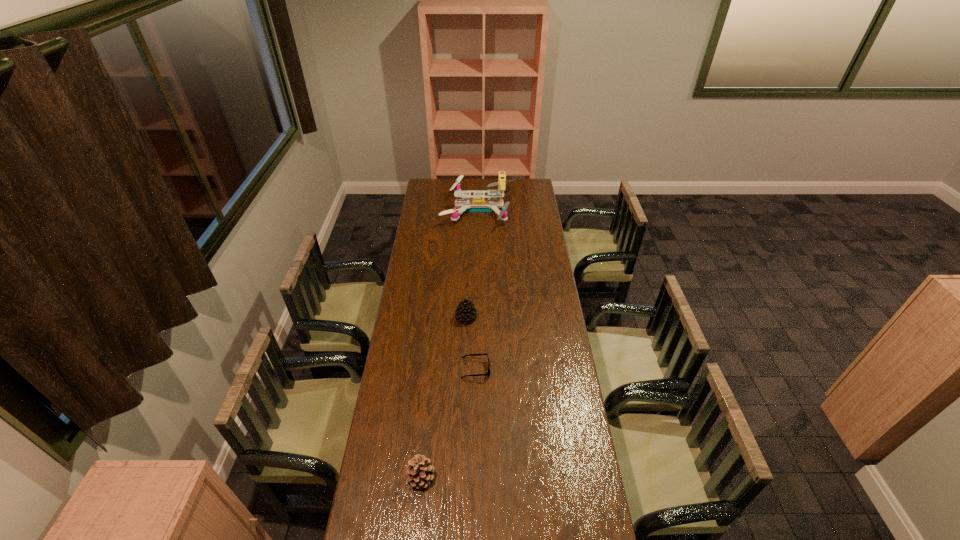
What are the coordinates of `vacant region at the right edge of the desktop` in the screenshot? It's located at (535, 220).

This screenshot has height=540, width=960. Find the location of `free space between the drone and the farther pinecone`. free space between the drone and the farther pinecone is located at coordinates (472, 263).

Find the location of a particular element. The image size is (960, 540). free space between the farthest object and the second nearest object is located at coordinates (477, 289).

At what (x,y) coordinates should I click in order to perform the action: click on free point between the second farthest object and the nearest object. Please return your answer as a coordinate pair (x, y). This screenshot has width=960, height=540. Looking at the image, I should click on (444, 397).

I want to click on empty space that is in between the right pinecone and the nearest object, so click(x=444, y=397).

Locate an element on the screen. This screenshot has height=540, width=960. empty location between the drone and the second nearest object is located at coordinates (477, 289).

The height and width of the screenshot is (540, 960). I want to click on free spot between the drone and the left pinecone, so click(450, 343).

Find the location of a particular element. The width and height of the screenshot is (960, 540). free space between the tallest object and the shortest object is located at coordinates (477, 289).

Identify the location of vacant area between the nearest object and the third nearest object. This screenshot has width=960, height=540. (444, 397).

Locate an element on the screen. Image resolution: width=960 pixels, height=540 pixels. vacant space that's between the left pinecone and the farthest object is located at coordinates (450, 343).